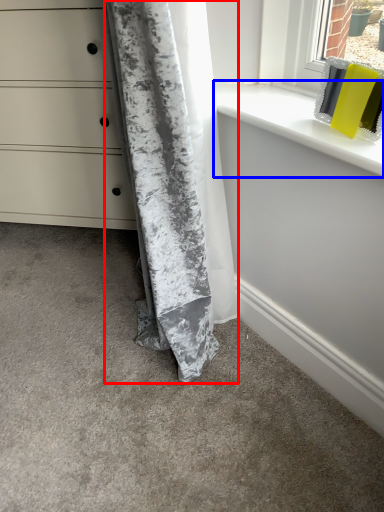
Question: Among these objects, which one is farthest to the camera, curtain (highlighted by a red box) or window sill (highlighted by a blue box)?

Choices:
 (A) curtain
 (B) window sill

Answer: (B)